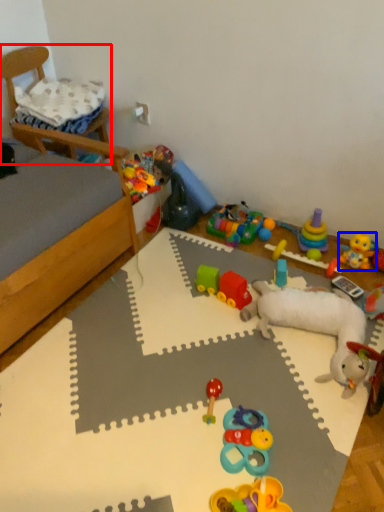
Question: Among these objects, which one is farthest to the camera, furniture (highlighted by a red box) or toy (highlighted by a blue box)?

Choices:
 (A) furniture
 (B) toy

Answer: (A)